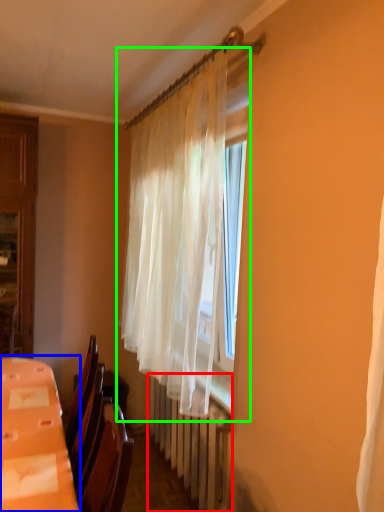
Question: Based on their relative distances, which object is nearer to radiator (highlighted by a red box)? Choose from table (highlighted by a blue box) and curtain (highlighted by a green box).

Choices:
 (A) table
 (B) curtain

Answer: (B)